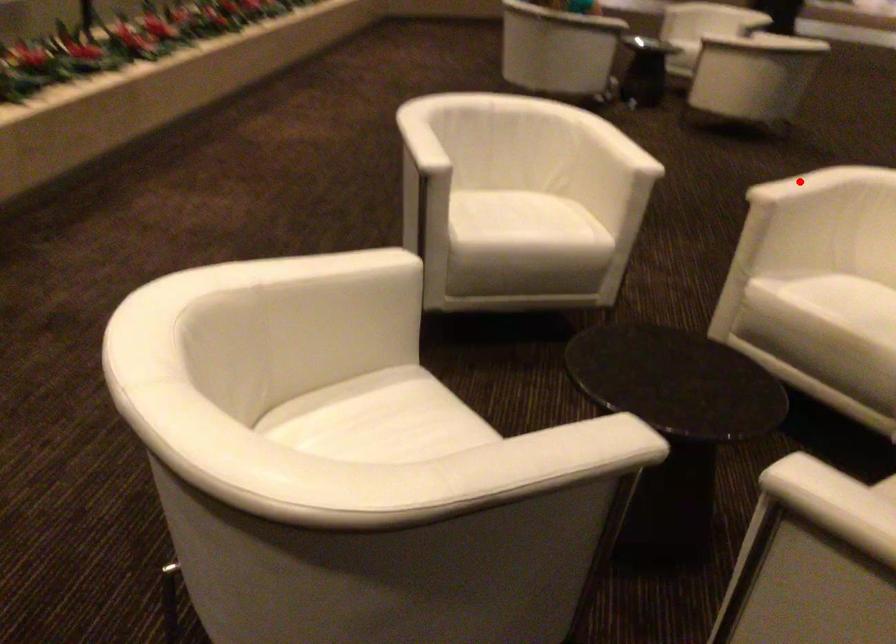
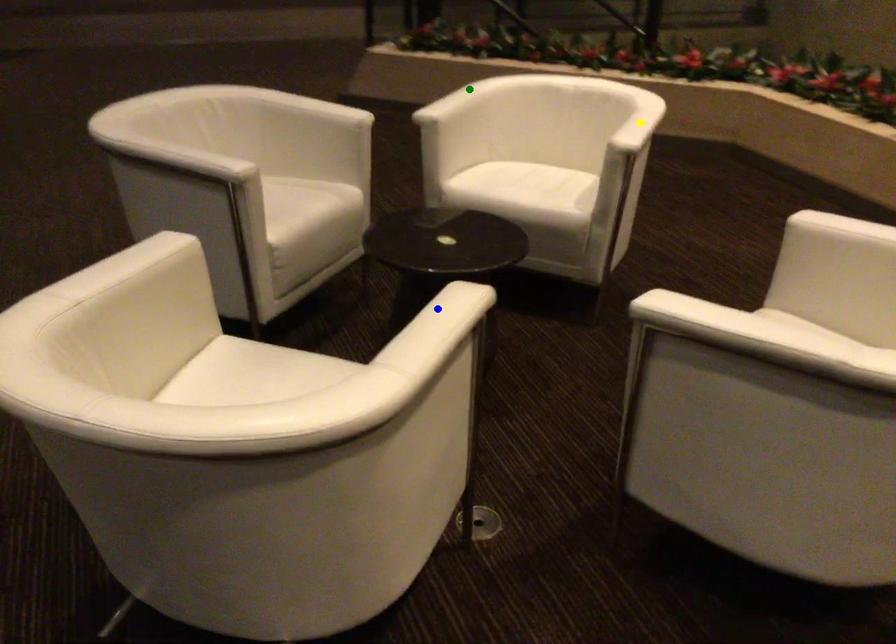
Question: I am providing you with two images of the same scene from different viewpoints. A red point is marked on the first image. You are given multiple points on the second image. Which point in image 2 is actually the same real-world point as the red point in image 1?

Choices:
 (A) blue point
 (B) yellow point
 (C) green point

Answer: (A)